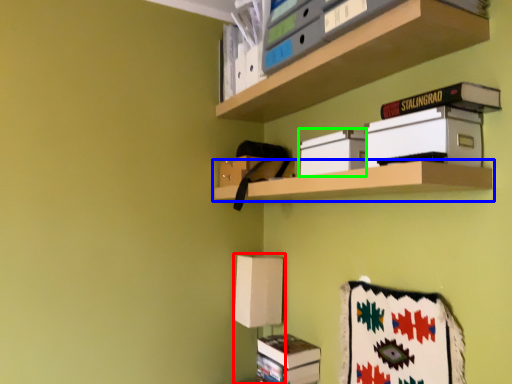
Question: Which object is positioned closest to table lamp (highlighted by a red box)? Select from shelf (highlighted by a blue box) and box (highlighted by a green box).

Choices:
 (A) shelf
 (B) box

Answer: (A)